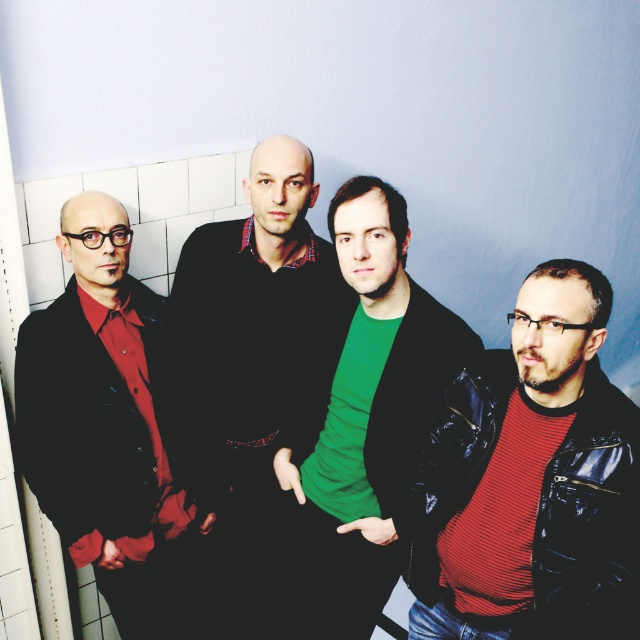
Question: From the image, what is the correct spatial relationship of matte black jacket at left in relation to green matte shirt at center?

Choices:
 (A) right
 (B) left

Answer: (B)

Question: Considering the relative positions of red striped sweater at right and matte black jacket at left in the image provided, where is red striped sweater at right located with respect to matte black jacket at left?

Choices:
 (A) below
 (B) above

Answer: (B)

Question: Among these points, which one is farthest from the camera?

Choices:
 (A) (593, 596)
 (B) (216, 516)
 (C) (464, 360)
 (D) (54, 468)

Answer: (B)

Question: Is matte black jacket at left wider than green matte shirt at center?

Choices:
 (A) no
 (B) yes

Answer: (A)

Question: Which point is farther from the camera taking this photo?

Choices:
 (A) (492, 576)
 (B) (88, 362)

Answer: (B)

Question: Among these points, which one is farthest from the camera?

Choices:
 (A) (490, 608)
 (B) (81, 522)
 (C) (317, 474)

Answer: (C)